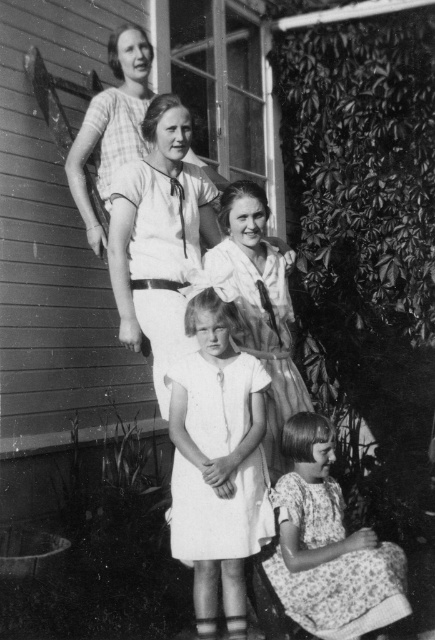
Does white cotton dress at center have a larger size compared to matte white blouse at center?

Actually, white cotton dress at center might be smaller than matte white blouse at center.

Consider the image. Is white cotton dress at center wider than matte white blouse at center?

No, white cotton dress at center is not wider than matte white blouse at center.

Measure the distance between white cotton dress at center and camera.

white cotton dress at center is 12.07 feet from camera.

Identify the location of white cotton dress at center. Image resolution: width=435 pixels, height=640 pixels. (217, 465).

In order to click on white cotton dress at center in this screenshot , I will do `click(217, 465)`.

Can you confirm if white cotton dress at center is positioned to the left of draped fabric dress at center?

Indeed, white cotton dress at center is positioned on the left side of draped fabric dress at center.

Who is more forward, (x=197, y=358) or (x=284, y=406)?

Point (x=197, y=358)

You are a GUI agent. You are given a task and a screenshot of the screen. Output one action in this format:
    pyautogui.click(x=<x>, y=<y>)
    Task: Click on the white cotton dress at center
    Image resolution: width=435 pixels, height=640 pixels.
    Given the screenshot: What is the action you would take?
    pyautogui.click(x=217, y=465)

Describe the element at coordinates (328, 547) in the screenshot. I see `floral dress at lower right` at that location.

Which is behind, point (368, 544) or point (287, 401)?

The point (287, 401) is behind.

What do you see at coordinates (328, 547) in the screenshot?
I see `floral dress at lower right` at bounding box center [328, 547].

Locate an element on the screen. This screenshot has height=640, width=435. floral dress at lower right is located at coordinates (328, 547).